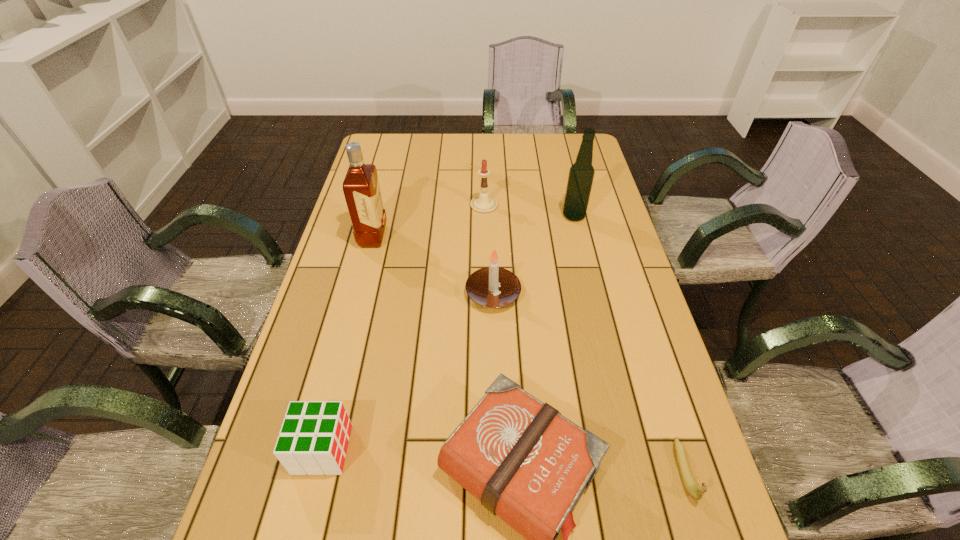
Image resolution: width=960 pixels, height=540 pixels. In the image, there is a desktop. Find the location of `free region at the far left corner`. free region at the far left corner is located at coordinates (391, 148).

You are a GUI agent. You are given a task and a screenshot of the screen. Output one action in this format:
    pyautogui.click(x=<x>, y=<y>)
    Task: Click on the vacant space at the far right corner
    
    Given the screenshot: What is the action you would take?
    pyautogui.click(x=564, y=145)

At what (x,y) coordinates should I click in order to perform the action: click on empty location between the shortest object and the fourth farthest object. Please return your answer as a coordinate pair (x, y). This screenshot has height=540, width=960. Looking at the image, I should click on (588, 382).

The width and height of the screenshot is (960, 540). In order to click on free spot between the second object from right to left and the rightmost object in this screenshot , I will do `click(629, 343)`.

I want to click on vacant area that lies between the shortest object and the farther candle, so click(584, 338).

This screenshot has height=540, width=960. Identify the location of empty space that is in between the cube and the alcohol. (448, 333).

This screenshot has width=960, height=540. I want to click on unoccupied area between the sixth object from left to right and the fifth nearest object, so click(x=473, y=226).

What are the coordinates of `vacant point located between the alcohol and the liquor` in the screenshot? It's located at (473, 226).

At what (x,y) coordinates should I click in order to perform the action: click on object that is the fifth closest to the Bible. Please return your answer as a coordinate pair (x, y). The width and height of the screenshot is (960, 540). Looking at the image, I should click on (581, 174).

Locate an element on the screen. Image resolution: width=960 pixels, height=540 pixels. object that is the closest to the sixth object from left to right is located at coordinates (483, 203).